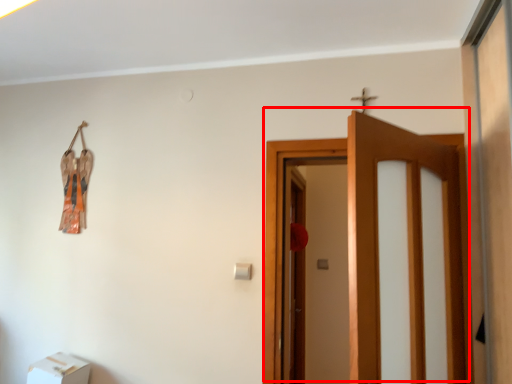
Question: From the image's perspective, where is door (annotated by the red box) located in relation to furniture in the image?

Choices:
 (A) below
 (B) above

Answer: (B)